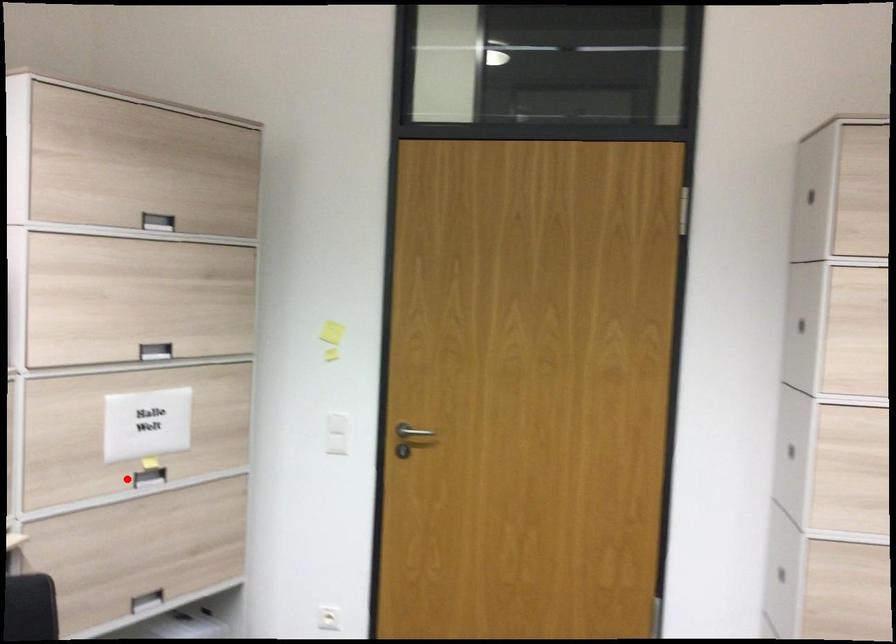
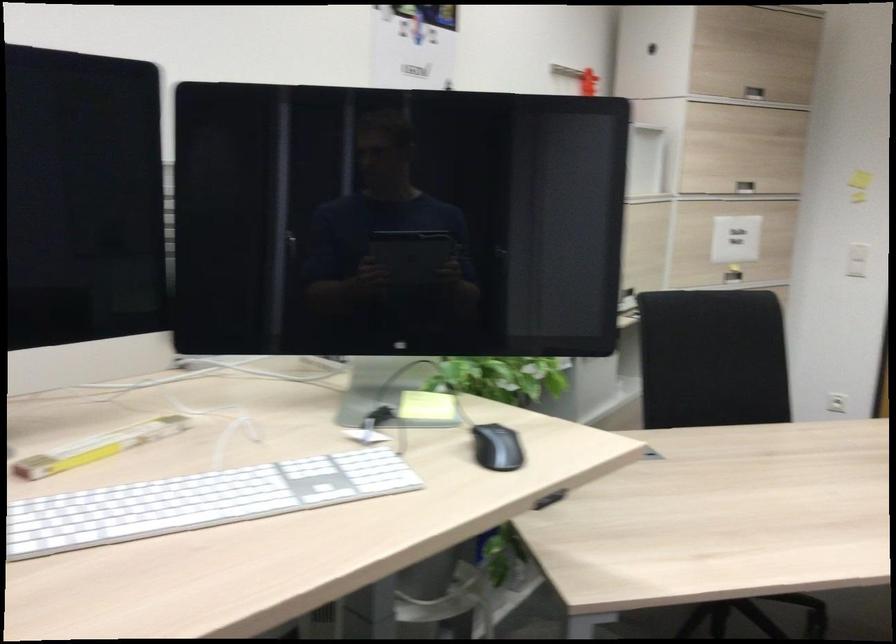
Question: I am providing you with two images of the same scene from different viewpoints. A red point is shown in image1. For the corresponding object point in image2, is it positioned nearer or farther from the camera?

Choices:
 (A) Nearer
 (B) Farther

Answer: (B)